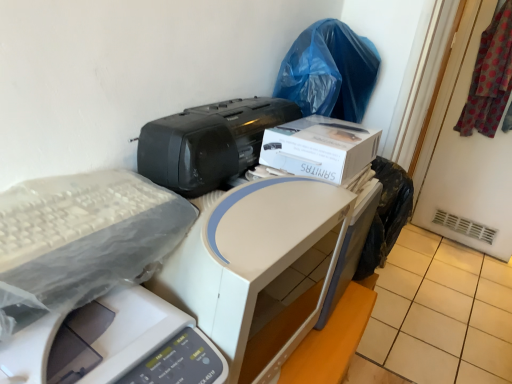
At what (x,y) coordinates should I click in order to perform the action: click on black plastic printer at center, arranged as the third printer when ordered from the bottom. Please return your answer as a coordinate pair (x, y). This screenshot has height=384, width=512. Looking at the image, I should click on (209, 143).

Describe the element at coordinates (95, 284) in the screenshot. The image size is (512, 384). I see `white plastic printer at center, which is the 1th printer in bottom-to-top order` at that location.

Locate an element on the screen. white cardboard box at upper center is located at coordinates (320, 148).

The image size is (512, 384). Find the location of `black plastic printer at center, arranged as the third printer when ordered from the bottom`. black plastic printer at center, arranged as the third printer when ordered from the bottom is located at coordinates (209, 143).

Does white plastic printer at center, which is the 1th printer in bottom-to-top order, appear on the right side of white cardboard box at upper center?

In fact, white plastic printer at center, which is the 1th printer in bottom-to-top order, is to the left of white cardboard box at upper center.

Which of these two, white plastic printer at center, acting as the third printer starting from the top, or white cardboard box at upper center, stands shorter?

white cardboard box at upper center.

Is white plastic printer at center, acting as the third printer starting from the top, next to white cardboard box at upper center?

white plastic printer at center, acting as the third printer starting from the top, and white cardboard box at upper center are not in contact.

Which object is positioned more to the right, black plastic printer at center, arranged as the third printer when ordered from the bottom, or blue plastic bag at upper right?

blue plastic bag at upper right is more to the right.

Is point (152, 138) behind point (333, 97)?

No, (152, 138) is closer to viewer.

From a real-world perspective, is black plastic printer at center, arranged as the third printer when ordered from the bottom, physically located above or below blue plastic bag at upper right?

black plastic printer at center, arranged as the third printer when ordered from the bottom, is below blue plastic bag at upper right.

Could you tell me if black plastic printer at center, which is counted as the first printer, starting from the top, is turned towards blue plastic bag at upper right?

No, black plastic printer at center, which is counted as the first printer, starting from the top, does not turn towards blue plastic bag at upper right.

Which of these two, black plastic printer at center, which is counted as the first printer, starting from the top, or white plastic printer at center, acting as the 2th printer starting from the bottom, is smaller?

black plastic printer at center, which is counted as the first printer, starting from the top, is smaller.

The width and height of the screenshot is (512, 384). I want to click on the 1st printer positioned below the black plastic printer at center, which is counted as the first printer, starting from the top (from the image's perspective), so click(x=255, y=267).

Is black plastic printer at center, arranged as the third printer when ordered from the bottom, thinner than white plastic printer at center, which is the 2th printer in top-to-bottom order?

Correct, the width of black plastic printer at center, arranged as the third printer when ordered from the bottom, is less than that of white plastic printer at center, which is the 2th printer in top-to-bottom order.

Is black plastic printer at center, which is counted as the first printer, starting from the top, closer to camera compared to white plastic printer at center, acting as the 2th printer starting from the bottom?

No, black plastic printer at center, which is counted as the first printer, starting from the top, is further to the viewer.

Is black plastic printer at center, arranged as the third printer when ordered from the bottom, next to white cardboard box at upper center?

No, black plastic printer at center, arranged as the third printer when ordered from the bottom, is not next to white cardboard box at upper center.

Does black plastic printer at center, which is counted as the first printer, starting from the top, have a smaller size compared to white cardboard box at upper center?

Incorrect, black plastic printer at center, which is counted as the first printer, starting from the top, is not smaller in size than white cardboard box at upper center.

In the scene shown: Is black plastic printer at center, arranged as the third printer when ordered from the bottom, closer to the viewer compared to white cardboard box at upper center?

Yes, black plastic printer at center, arranged as the third printer when ordered from the bottom, is closer to the camera.

Between black plastic printer at center, which is counted as the first printer, starting from the top, and white cardboard box at upper center, which one appears on the right side from the viewer's perspective?

white cardboard box at upper center.

Is beige tile at lower right looking in the opposite direction of polka dot fabric at upper right?

No, polka dot fabric at upper right is not at the back of beige tile at lower right.

Locate an element on the screen. The height and width of the screenshot is (384, 512). tile in front of the polka dot fabric at upper right is located at coordinates (441, 313).

From a real-world perspective, relative to polka dot fabric at upper right, is beige tile at lower right vertically above or below?

From a real-world perspective, beige tile at lower right is physically below polka dot fabric at upper right.

How different are the orientations of beige tile at lower right and polka dot fabric at upper right in degrees?

The angle between the facing direction of beige tile at lower right and the facing direction of polka dot fabric at upper right is 4.69 degrees.

Can you confirm if blue plastic bag at upper right is wider than polka dot fabric at upper right?

Correct, the width of blue plastic bag at upper right exceeds that of polka dot fabric at upper right.

Is blue plastic bag at upper right directly adjacent to polka dot fabric at upper right?

No, blue plastic bag at upper right is not making contact with polka dot fabric at upper right.

Locate an element on the screen. The image size is (512, 384). material below the blue plastic bag at upper right (from a real-world perspective) is located at coordinates (x=490, y=78).

From the image's perspective, is blue plastic bag at upper right under polka dot fabric at upper right?

Yes, from the image's perspective, blue plastic bag at upper right is beneath polka dot fabric at upper right.

Looking at this image, is white plastic printer at center, acting as the 2th printer starting from the bottom, beside blue plastic bag at upper right?

white plastic printer at center, acting as the 2th printer starting from the bottom, and blue plastic bag at upper right are clearly separated.

Which is further, [267,203] or [300,97]?

The point [300,97] is farther.

Is blue plastic bag at upper right inside white plastic printer at center, which is the 2th printer in top-to-bottom order?

No, blue plastic bag at upper right is not inside white plastic printer at center, which is the 2th printer in top-to-bottom order.

Where is `box above the white plastic printer at center, acting as the third printer starting from the top (from the image's perspective)`? box above the white plastic printer at center, acting as the third printer starting from the top (from the image's perspective) is located at coordinates (320, 148).

From the blue plastic bag at upper right, count 1st printers forward and point to it. Please provide its 2D coordinates.

[(209, 143)]

Which object lies further to the anchor point blue plastic bag at upper right, white cardboard box at upper center or polka dot fabric at upper right?

polka dot fabric at upper right is positioned further to the anchor blue plastic bag at upper right.

When comparing their distances from black plastic printer at center, which is counted as the first printer, starting from the top, does white plastic printer at center, which is the 2th printer in top-to-bottom order, or beige tile at lower right seem further?

Among the two, beige tile at lower right is located further to black plastic printer at center, which is counted as the first printer, starting from the top.

Looking at the image, which one is located further to white plastic printer at center, which is the 2th printer in top-to-bottom order, polka dot fabric at upper right or blue plastic bag at upper right?

polka dot fabric at upper right.

Looking at the image, which one is located closer to beige tile at lower right, blue plastic bag at upper right or white plastic printer at center, which is the 2th printer in top-to-bottom order?

blue plastic bag at upper right lies closer to beige tile at lower right than the other object.

Looking at this image, from the image, which object appears to be nearer to white plastic printer at center, acting as the 2th printer starting from the bottom, beige tile at lower right or black plastic printer at center, which is counted as the first printer, starting from the top?

black plastic printer at center, which is counted as the first printer, starting from the top.

Based on their spatial positions, is polka dot fabric at upper right or blue plastic bag at upper right further from white cardboard box at upper center?

Among the two, polka dot fabric at upper right is located further to white cardboard box at upper center.

Looking at the image, which one is located closer to blue plastic bag at upper right, white plastic printer at center, acting as the 2th printer starting from the bottom, or beige tile at lower right?

Among the two, white plastic printer at center, acting as the 2th printer starting from the bottom, is located nearer to blue plastic bag at upper right.

Based on the photo, looking at the image, which one is located further to polka dot fabric at upper right, white plastic printer at center, acting as the 2th printer starting from the bottom, or white cardboard box at upper center?

The object further to polka dot fabric at upper right is white plastic printer at center, acting as the 2th printer starting from the bottom.

This screenshot has width=512, height=384. What are the coordinates of `garbage situated between white plastic printer at center, which is the 1th printer in bottom-to-top order, and beige tile at lower right from left to right` in the screenshot? It's located at (329, 71).

Find the location of a particular element. This screenshot has width=512, height=384. tile between white cardboard box at upper center and polka dot fabric at upper right in the front-back direction is located at coordinates (441, 313).

At what (x,y) coordinates should I click in order to perform the action: click on box located between white plastic printer at center, which is the 1th printer in bottom-to-top order, and blue plastic bag at upper right in the depth direction. Please return your answer as a coordinate pair (x, y). Looking at the image, I should click on (320, 148).

Find the location of `garbage between white cardboard box at upper center and beige tile at lower right from left to right`. garbage between white cardboard box at upper center and beige tile at lower right from left to right is located at coordinates (329, 71).